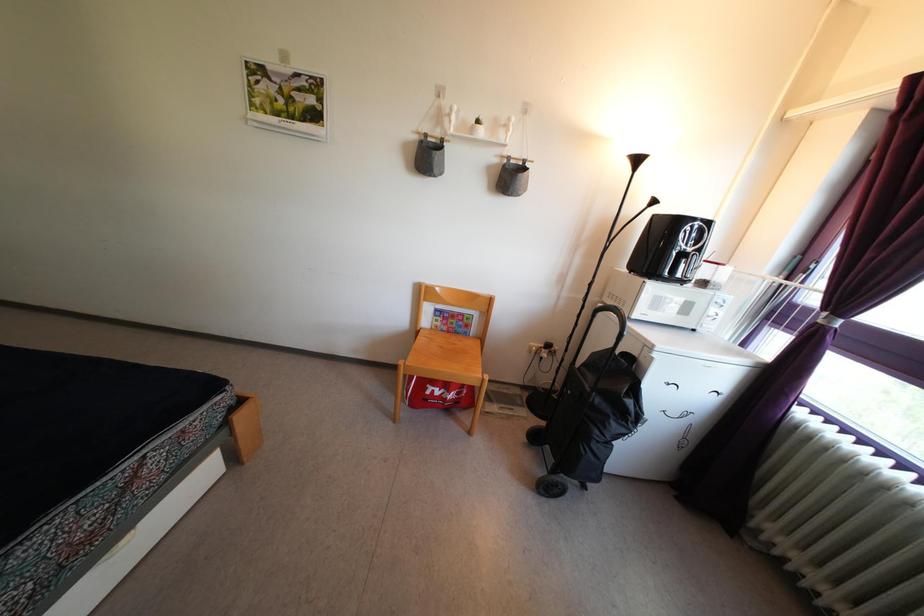
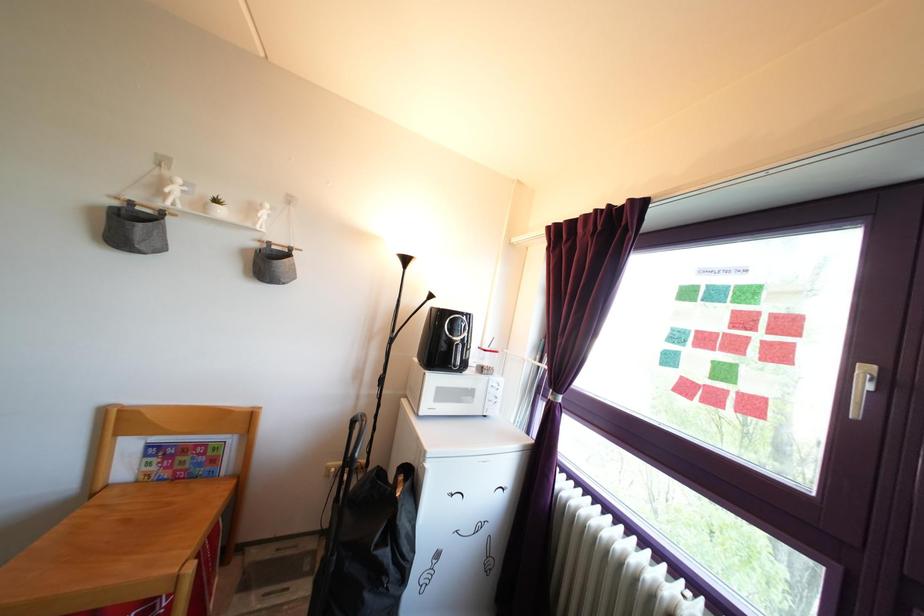
Where in the second image is the point corresponding to pixel 480 130 from the first image?

(219, 209)